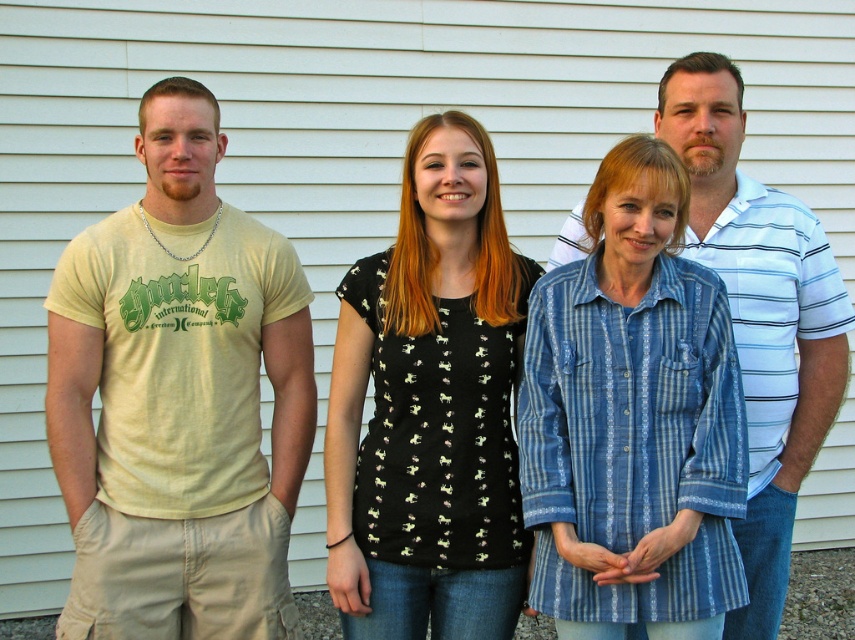
Does light yellow t-shirt at left have a lesser width compared to black printed blouse at center?

No.

Is point (57, 333) behind point (360, 448)?

Yes, point (57, 333) is behind point (360, 448).

Does point (222, 632) come in front of point (346, 326)?

No, (222, 632) is behind (346, 326).

The image size is (855, 640). Identify the location of light yellow t-shirt at left. (178, 397).

Measure the distance between point (490, 316) and camera.

A distance of 2.85 meters exists between point (490, 316) and camera.

Which is behind, point (441, 113) or point (824, 260)?

The point (441, 113) is more distant.

Between point (398, 260) and point (764, 362), which one is positioned behind?

The point (764, 362) is behind.

You are a GUI agent. You are given a task and a screenshot of the screen. Output one action in this format:
    pyautogui.click(x=<x>, y=<y>)
    Task: Click on the black printed blouse at center
    This screenshot has width=855, height=640.
    Given the screenshot: What is the action you would take?
    pyautogui.click(x=429, y=406)

Who is shorter, light yellow t-shirt at left or white striped polo shirt at center?

Standing shorter between the two is light yellow t-shirt at left.

Can you confirm if light yellow t-shirt at left is positioned to the right of white striped polo shirt at center?

No, light yellow t-shirt at left is not to the right of white striped polo shirt at center.

The width and height of the screenshot is (855, 640). Describe the element at coordinates (178, 397) in the screenshot. I see `light yellow t-shirt at left` at that location.

The width and height of the screenshot is (855, 640). Identify the location of light yellow t-shirt at left. (178, 397).